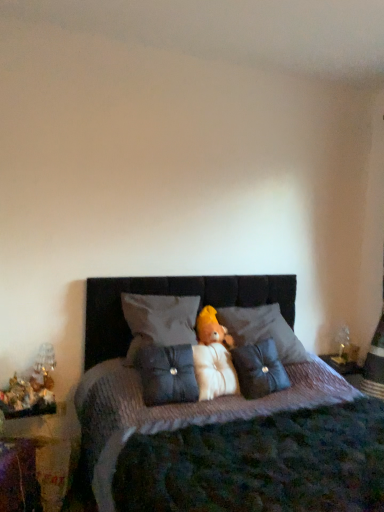
Question: Is gray fabric pillow at center, which is counted as the first pillow, starting from the left, turned away from velvet plush bear at center?

Choices:
 (A) no
 (B) yes

Answer: (A)

Question: Is gray fabric pillow at center, which is the 3th pillow from right to left, taller than velvet plush bear at center?

Choices:
 (A) no
 (B) yes

Answer: (A)

Question: Are gray fabric pillow at center, which is counted as the first pillow, starting from the left, and velvet plush bear at center located far from each other?

Choices:
 (A) yes
 (B) no

Answer: (B)

Question: Is gray fabric pillow at center, which is the 3th pillow from right to left, behind velvet plush bear at center?

Choices:
 (A) no
 (B) yes

Answer: (B)

Question: From the image's perspective, does gray fabric pillow at center, which is counted as the first pillow, starting from the left, appear lower than velvet plush bear at center?

Choices:
 (A) no
 (B) yes

Answer: (A)

Question: Does gray fabric pillow at center, which is counted as the first pillow, starting from the left, have a lesser width compared to velvet plush bear at center?

Choices:
 (A) yes
 (B) no

Answer: (B)

Question: Is gray fabric pillow at center, which is the 3th pillow from right to left, wider than suede-like dark blue pillow at center, the 2th pillow viewed from the right?

Choices:
 (A) yes
 (B) no

Answer: (A)

Question: From the image's perspective, is gray fabric pillow at center, which is counted as the first pillow, starting from the left, below suede-like dark blue pillow at center, the second pillow from the left?

Choices:
 (A) yes
 (B) no

Answer: (B)

Question: Can you confirm if gray fabric pillow at center, which is the 3th pillow from right to left, is taller than suede-like dark blue pillow at center, the 2th pillow viewed from the right?

Choices:
 (A) no
 (B) yes

Answer: (A)

Question: Can you confirm if gray fabric pillow at center, which is counted as the first pillow, starting from the left, is shorter than suede-like dark blue pillow at center, the second pillow from the left?

Choices:
 (A) no
 (B) yes

Answer: (B)

Question: Can suede-like dark blue pillow at center, the 2th pillow viewed from the right, be found inside gray fabric pillow at center, which is the 3th pillow from right to left?

Choices:
 (A) no
 (B) yes

Answer: (A)

Question: Could you tell me if gray fabric pillow at center, which is the 3th pillow from right to left, is turned towards suede-like dark blue pillow at center, the 2th pillow viewed from the right?

Choices:
 (A) no
 (B) yes

Answer: (A)

Question: Considering the relative sizes of velvet dark brown bed at center and suede-like dark blue pillow at center, the 2th pillow viewed from the right, in the image provided, is velvet dark brown bed at center bigger than suede-like dark blue pillow at center, the 2th pillow viewed from the right,?

Choices:
 (A) no
 (B) yes

Answer: (B)